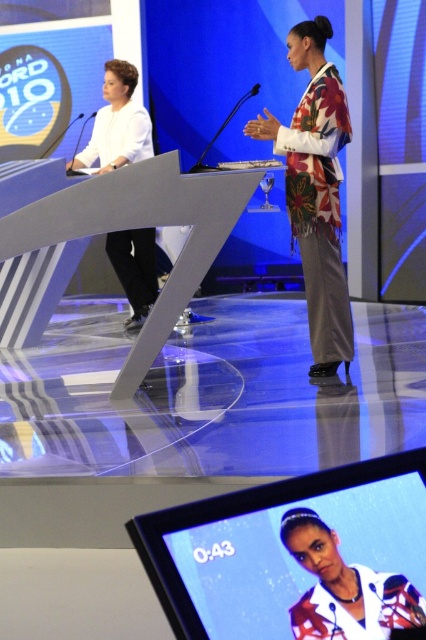
Who is taller, metallic gray podium at center or white matte shirt at left?

metallic gray podium at center

Image resolution: width=426 pixels, height=640 pixels. What do you see at coordinates (138, 227) in the screenshot? I see `metallic gray podium at center` at bounding box center [138, 227].

Find the location of a particular element. metallic gray podium at center is located at coordinates (138, 227).

Is matte digital display at center to the left of white matte shirt at left from the viewer's perspective?

No, matte digital display at center is not to the left of white matte shirt at left.

Does point (307, 634) come behind point (137, 300)?

That is False.

The image size is (426, 640). In order to click on matte digital display at center in this screenshot , I will do `click(294, 556)`.

This screenshot has height=640, width=426. Find the location of `matte digital display at center`. matte digital display at center is located at coordinates (294, 556).

Can you confirm if floral-patterned fabric at center is taller than white matte shirt at left?

Yes, floral-patterned fabric at center is taller than white matte shirt at left.

Does floral-patterned fabric at center have a lesser width compared to white matte shirt at left?

Correct, floral-patterned fabric at center's width is less than white matte shirt at left's.

The width and height of the screenshot is (426, 640). Identify the location of floral-patterned fabric at center. (316, 189).